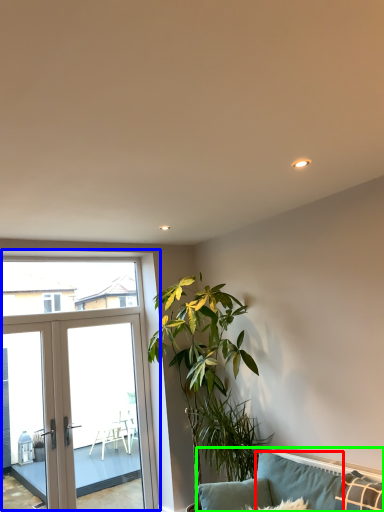
Question: Estimate the real-world distances between objects in this image. Which object is farther from pillow (highlighted by a red box), window (highlighted by a blue box) or studio couch (highlighted by a green box)?

Choices:
 (A) window
 (B) studio couch

Answer: (A)